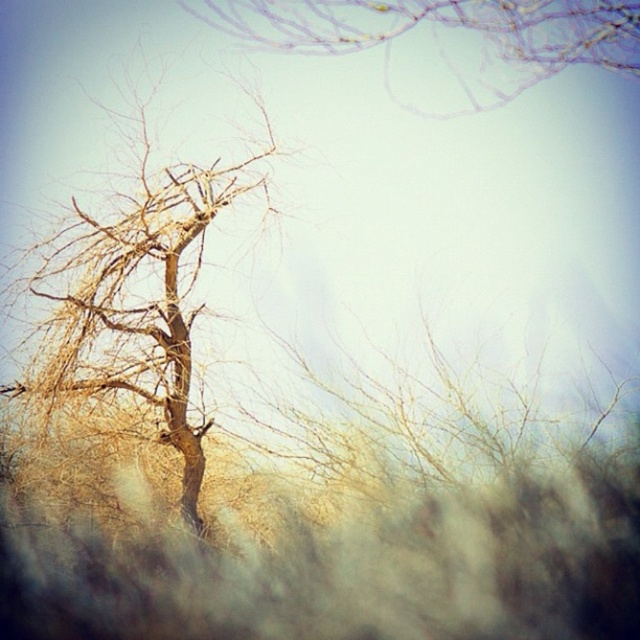
You are an artist sketching the winter scene. You need to decide which object to draw first based on their height. Which one should you start with, the bare wood tree at left or the bare branches at upper center?

The bare wood tree at left is taller than the bare branches at upper center, so you should start with the bare wood tree at left to ensure proper scaling in your sketch.

You are standing in a winter landscape and want to take a photo of the bare wood tree at left and the bare branches at upper center. Which object should you focus on first to ensure both are in sharp focus?

You should focus on the bare wood tree at left first because it is closer to the viewer than the bare branches at upper center, so adjusting focus from near to far will help both be in focus.